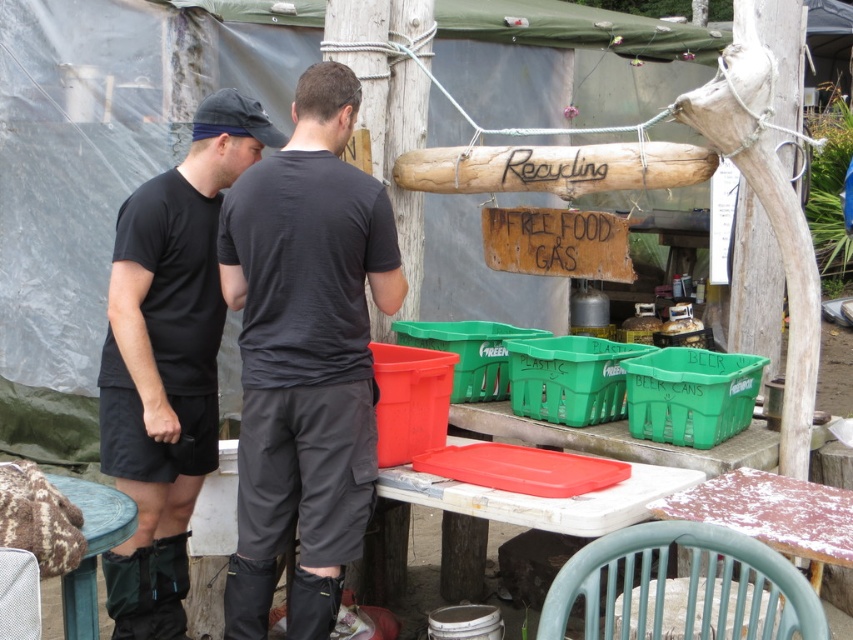
Question: Which of these objects is positioned farthest from the black matte t-shirt at left?

Choices:
 (A) white plastic table at center
 (B) dark gray cotton shirt at center

Answer: (A)

Question: Which of the following is the closest to the observer?

Choices:
 (A) (137, 388)
 (B) (556, 529)
 (C) (53, 476)
 (D) (300, 253)

Answer: (B)

Question: Is dark gray cotton shirt at center closer to the viewer compared to white plastic table at center?

Choices:
 (A) no
 (B) yes

Answer: (A)

Question: Does dark gray cotton shirt at center have a greater width compared to wooden table at lower left?

Choices:
 (A) yes
 (B) no

Answer: (A)

Question: Is white plastic table at center to the right of wooden table at lower left from the viewer's perspective?

Choices:
 (A) no
 (B) yes

Answer: (B)

Question: Which object is the closest to the dark gray cotton shirt at center?

Choices:
 (A) wooden table at lower left
 (B) white plastic table at center
 (C) black matte t-shirt at left

Answer: (C)